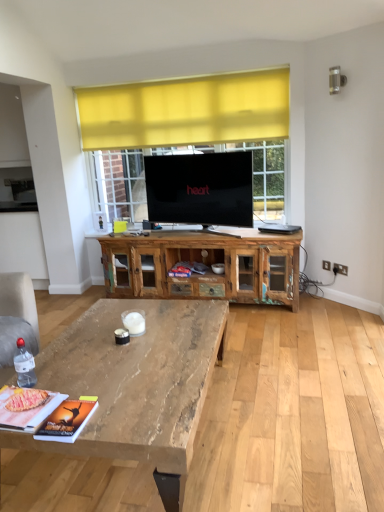
Locate an element on the screen. The width and height of the screenshot is (384, 512). empty space that is ontop of natural wood coffee table at lower left (from a real-world perspective) is located at coordinates (104, 357).